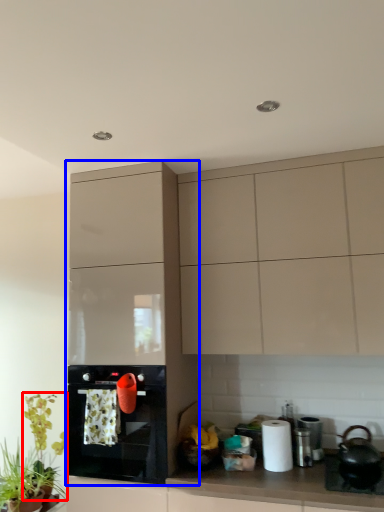
Question: Which object is further to the camera taking this photo, plant (highlighted by a red box) or cabinetry (highlighted by a blue box)?

Choices:
 (A) plant
 (B) cabinetry

Answer: (A)